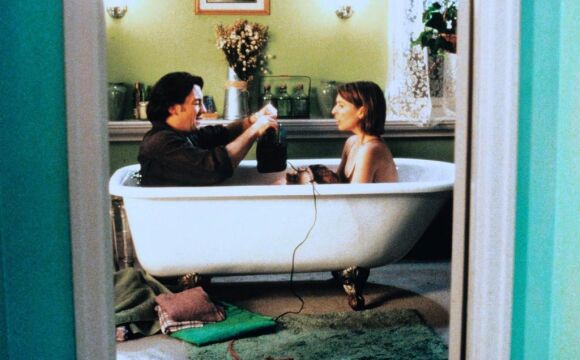
At what (x,y) coordinates should I click in order to perform the action: click on tear blue walls. Please return your answer as a coordinate pair (x, y). The height and width of the screenshot is (360, 580). Looking at the image, I should click on (48, 242), (548, 208).